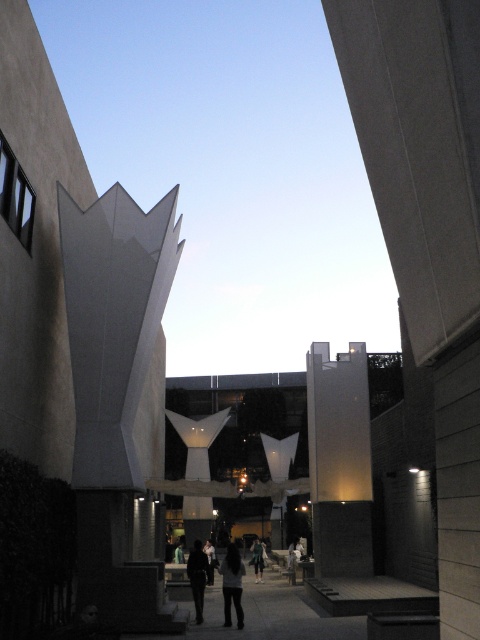
Question: Is white matte sculpture at upper center smaller than dark gray pants at center?

Choices:
 (A) yes
 (B) no

Answer: (B)

Question: Which point is closer to the camera?

Choices:
 (A) dark gray fabric jacket at center
 (B) satin white pillar at center
 (C) white matte sculpture at upper center
 (D) dark clothing at center

Answer: (D)

Question: Does white matte sculpture at left come behind dark gray pants at center?

Choices:
 (A) no
 (B) yes

Answer: (A)

Question: Which object appears closest to the camera in this image?

Choices:
 (A) dark gray fabric jacket at center
 (B) white matte sculpture at left
 (C) satin white pillar at center

Answer: (B)

Question: Which is nearer to the white matte sculpture at upper center?

Choices:
 (A) dark gray fabric pants at center
 (B) white matte sculpture at left

Answer: (B)

Question: Is dark gray pants at center thinner than dark gray fabric pants at center?

Choices:
 (A) no
 (B) yes

Answer: (B)